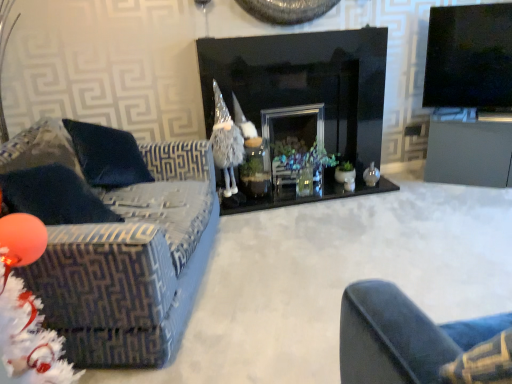
The width and height of the screenshot is (512, 384). In order to click on free space in front of black glass fireplace at center in this screenshot , I will do `click(340, 256)`.